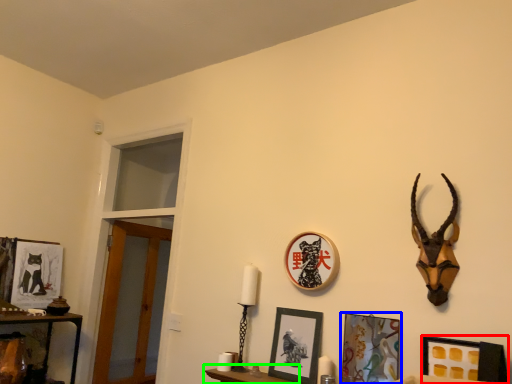
Question: Considering the real-world distances, which object is farthest from picture frame (highlighted by a red box)? picture frame (highlighted by a blue box) or furniture (highlighted by a green box)?

Choices:
 (A) picture frame
 (B) furniture

Answer: (B)